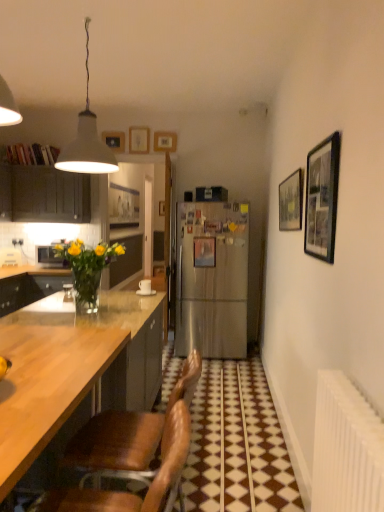
Question: From the image's perspective, is brown leather chair at lower left, marked as the first chair in a back-to-front arrangement, positioned above or below matte dark wood cabinet at left?

Choices:
 (A) below
 (B) above

Answer: (A)

Question: From their relative heights in the image, would you say brown leather chair at lower left, the second chair viewed from the front, is taller or shorter than matte dark wood cabinet at left?

Choices:
 (A) short
 (B) tall

Answer: (B)

Question: Estimate the real-world distances between objects in this image. Which object is closer to the brown leather chair at lower left, marked as the first chair in a back-to-front arrangement?

Choices:
 (A) wooden picture frame at upper right, placed as the 6th picture frame when sorted from left to right
 (B) wooden picture frame at upper center, the 5th picture frame positioned from the front
 (C) brushed metal microwave at left
 (D) black matte picture frame at upper right, the 1th picture frame viewed from the front
 (E) brown leather chair at lower center, which ranks as the 1th chair in front-to-back order

Answer: (E)

Question: Which is farther from the black matte picture frame at upper right, placed as the 6th picture frame when sorted from back to front?

Choices:
 (A) brushed metal microwave at left
 (B) matte wooden picture frame at upper center, which is the 1th picture frame from back to front
 (C) wooden picture frame at upper center, which ranks as the fourth picture frame in left-to-right order
 (D) brown leather chair at lower left, the second chair viewed from the front
 (E) brown leather chair at lower center, the second chair positioned from the back

Answer: (B)